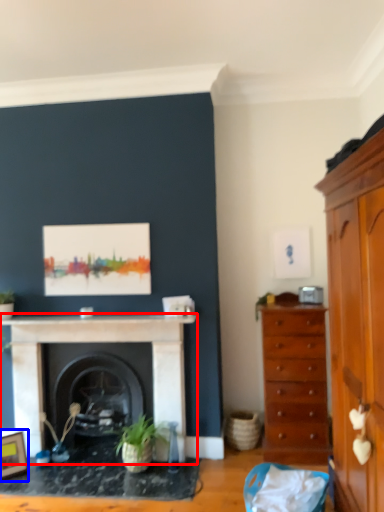
Question: Which point is further to the camera, fireplace (highlighted by a red box) or picture frame (highlighted by a blue box)?

Choices:
 (A) fireplace
 (B) picture frame

Answer: (A)